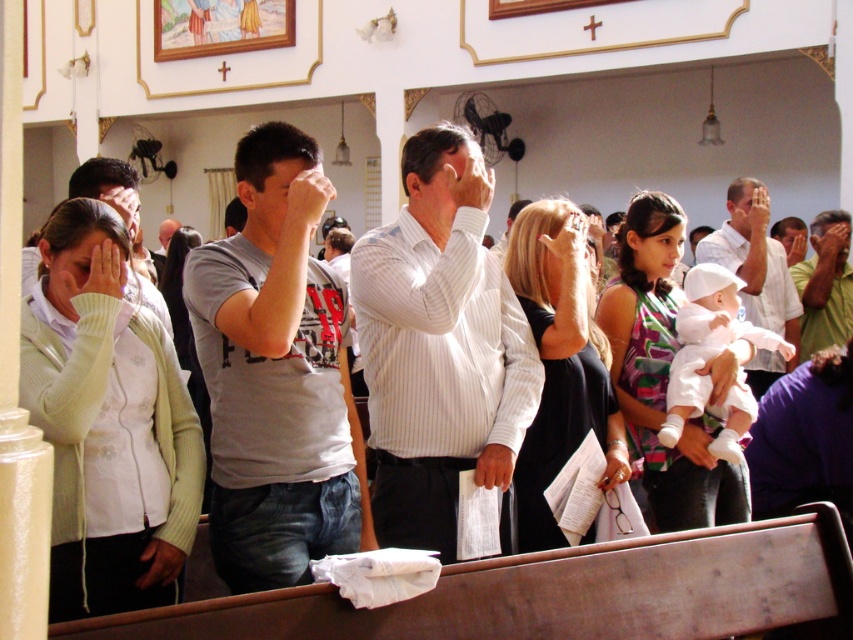
Question: Considering the real-world distances, which object is closest to the white cotton baby at center?

Choices:
 (A) white cotton shirt at center
 (B) gray cotton t-shirt at center

Answer: (B)

Question: Can you confirm if white striped shirt at center is wider than white cotton baby at center?

Choices:
 (A) yes
 (B) no

Answer: (B)

Question: Which object is farther from the camera taking this photo?

Choices:
 (A) white cotton baby at center
 (B) green cotton shirt at center
 (C) white striped shirt at center
 (D) gray cotton t-shirt at center

Answer: (B)

Question: Is white striped shirt at center wider than white cotton shirt at center?

Choices:
 (A) yes
 (B) no

Answer: (B)

Question: Which of the following is the closest to the observer?

Choices:
 (A) white cotton shirt at center
 (B) white cotton baby at center

Answer: (B)

Question: Can you confirm if white cotton baby at center is bigger than white cotton shirt at center?

Choices:
 (A) yes
 (B) no

Answer: (A)